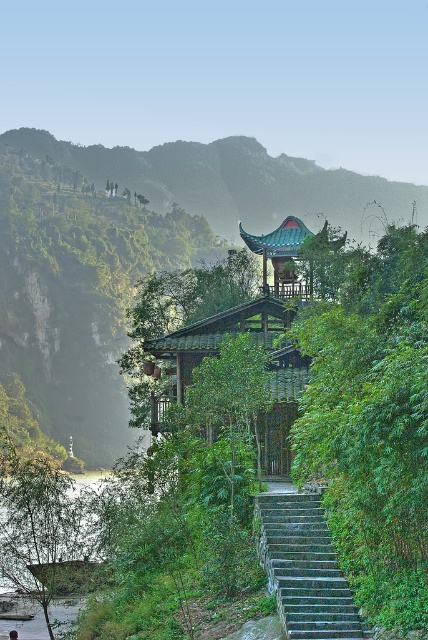
Does green leafy bush at center come in front of green leafy river at lower left?

Yes, green leafy bush at center is in front of green leafy river at lower left.

Can you confirm if green leafy bush at center is positioned above green leafy river at lower left?

Indeed, green leafy bush at center is positioned over green leafy river at lower left.

What do you see at coordinates (371, 419) in the screenshot? Image resolution: width=428 pixels, height=640 pixels. I see `green leafy bush at center` at bounding box center [371, 419].

The height and width of the screenshot is (640, 428). In order to click on green leafy bush at center in this screenshot , I will do `click(371, 419)`.

Is green wooden pavilion at upper center shorter than stone steps at center?

Incorrect, green wooden pavilion at upper center's height does not fall short of stone steps at center's.

Identify the location of green wooden pavilion at upper center. The image size is (428, 640). (234, 182).

Does green leafy bush at center have a greater height compared to stone steps at center?

Yes, green leafy bush at center is taller than stone steps at center.

Image resolution: width=428 pixels, height=640 pixels. What do you see at coordinates (371, 419) in the screenshot? I see `green leafy bush at center` at bounding box center [371, 419].

Describe the element at coordinates (371, 419) in the screenshot. I see `green leafy bush at center` at that location.

Image resolution: width=428 pixels, height=640 pixels. In order to click on green leafy bush at center in this screenshot , I will do `click(371, 419)`.